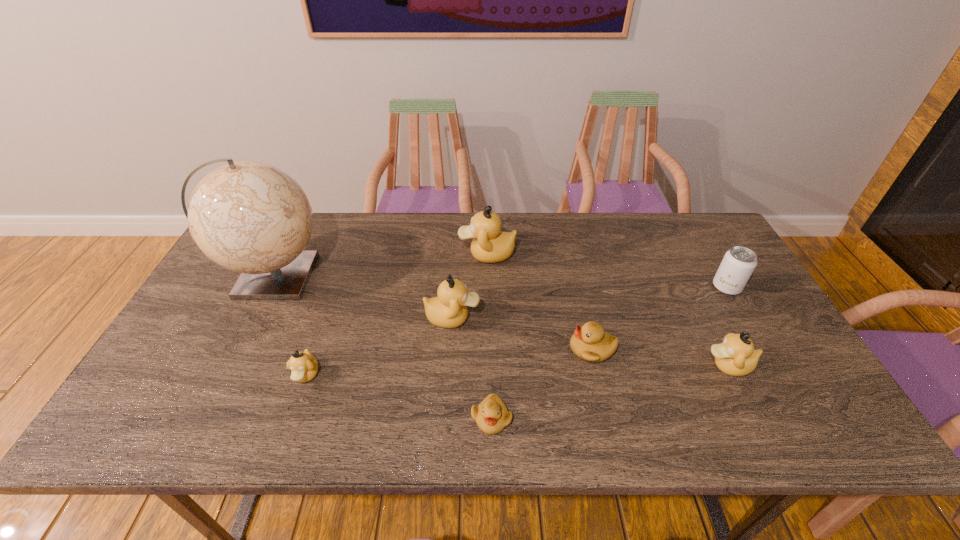
You are a GUI agent. You are given a task and a screenshot of the screen. Output one action in this format:
    pyautogui.click(x=<x>, y=<y>)
    Task: Click on the free space located on the left of the rightmost object
    This screenshot has height=540, width=960.
    Given the screenshot: What is the action you would take?
    pyautogui.click(x=651, y=287)

The height and width of the screenshot is (540, 960). Find the location of `vacant space located 0.300m on the face of the rightmost duckling`. vacant space located 0.300m on the face of the rightmost duckling is located at coordinates (582, 366).

You are a GUI agent. You are given a task and a screenshot of the screen. Output one action in this format:
    pyautogui.click(x=<x>, y=<y>)
    Task: Click on the vacant space situated on the face of the rightmost duckling
    This screenshot has height=540, width=960.
    Given the screenshot: What is the action you would take?
    pyautogui.click(x=586, y=366)

Find the location of a particular element. vacant space positioned on the face of the rightmost duckling is located at coordinates (565, 366).

Locate an element on the screen. free point located on the front-facing side of the third object from right to left is located at coordinates (538, 349).

The image size is (960, 540). Identify the location of free space located on the front-facing side of the third object from right to left. [x=447, y=349].

The height and width of the screenshot is (540, 960). I want to click on free space located on the front-facing side of the third object from right to left, so (x=541, y=349).

This screenshot has height=540, width=960. I want to click on vacant space positioned on the face of the leftmost tan duckling, so click(x=293, y=415).

This screenshot has height=540, width=960. I want to click on globe at the far edge, so click(252, 218).

Where is `duckling present at the far edge`? The width and height of the screenshot is (960, 540). duckling present at the far edge is located at coordinates (490, 245).